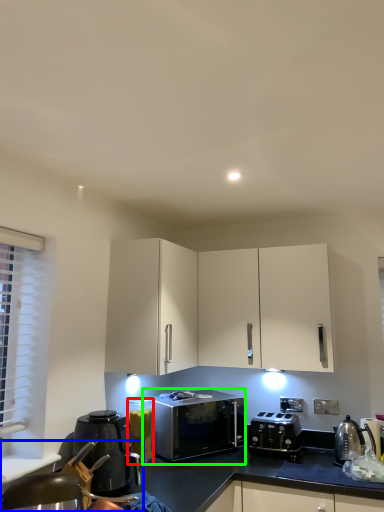
Question: Which object is the closest to the appliance (highlighted by a red box)? Choose among these: swivel chair (highlighted by a blue box) or microwave oven (highlighted by a green box).

Choices:
 (A) swivel chair
 (B) microwave oven

Answer: (B)